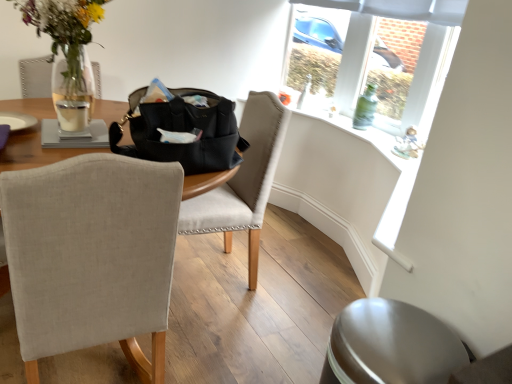
Find the location of a particular element. The image size is (512, 384). spots to the right of beige fabric chair at left, the first chair viewed from the front is located at coordinates click(223, 349).